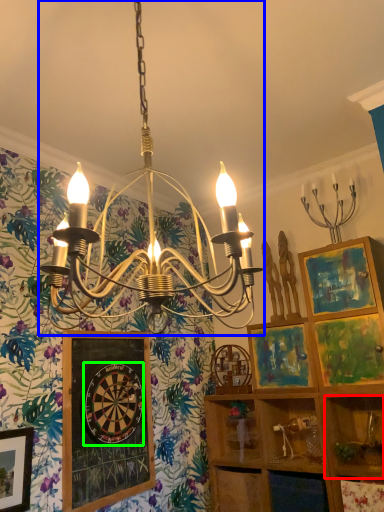
Question: Which is farther away from shelf (highlighted by a red box)? lamp (highlighted by a blue box) or design (highlighted by a green box)?

Choices:
 (A) lamp
 (B) design

Answer: (B)